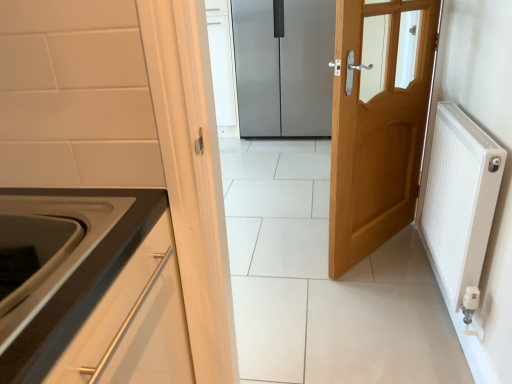
Locate an element on the screen. This screenshot has width=512, height=384. vacant region under light wood door at center, acting as the first door starting from the front (from a real-world perspective) is located at coordinates (383, 249).